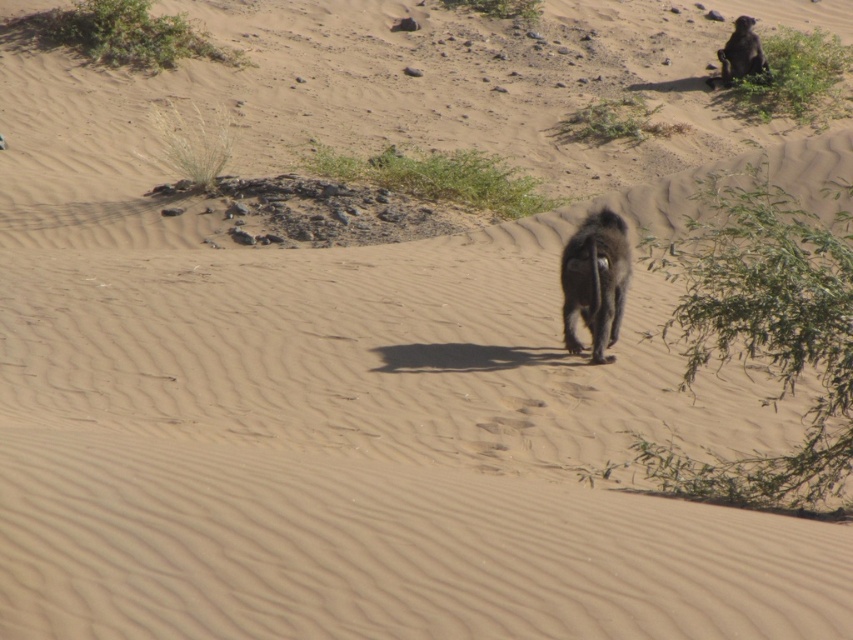
Describe the element at coordinates (595, 282) in the screenshot. I see `brown furry monkey at center` at that location.

This screenshot has width=853, height=640. I want to click on brown furry monkey at center, so click(595, 282).